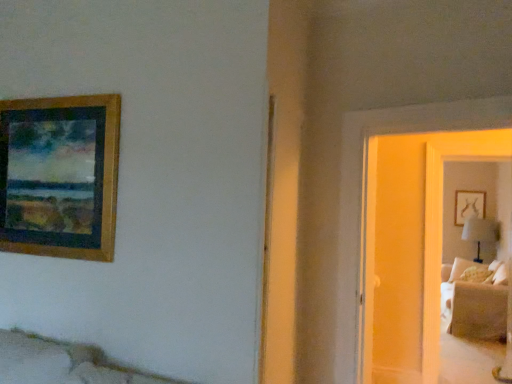
The width and height of the screenshot is (512, 384). What do you see at coordinates (480, 232) in the screenshot?
I see `white fabric table lamp at right` at bounding box center [480, 232].

Where is `wooden picture frame at upper left`? The width and height of the screenshot is (512, 384). wooden picture frame at upper left is located at coordinates (60, 176).

Describe the element at coordinates (411, 247) in the screenshot. I see `matte glass door at right` at that location.

What do you see at coordinates (475, 308) in the screenshot? I see `suede beige couch at right` at bounding box center [475, 308].

The image size is (512, 384). Find the location of `white fabric table lamp at right`. white fabric table lamp at right is located at coordinates (480, 232).

Are wooden picture frame at upper left and white fabric table lamp at right located far from each other?

wooden picture frame at upper left is positioned a significant distance from white fabric table lamp at right.

Which is correct: wooden picture frame at upper left is inside white fabric table lamp at right, or outside of it?

wooden picture frame at upper left exists outside the volume of white fabric table lamp at right.

Which is behind, point (44, 148) or point (476, 229)?

The point (476, 229) is farther from the camera.

From the image's perspective, is wooden picture frame at upper left located above or below white fabric table lamp at right?

wooden picture frame at upper left is above white fabric table lamp at right.

In the image, is white fabric table lamp at right positioned in front of or behind matte glass door at right?

white fabric table lamp at right is positioned farther from the viewer than matte glass door at right.

Does point (465, 220) appear closer or farther from the camera than point (406, 297)?

Point (465, 220) is positioned farther from the camera compared to point (406, 297).

In the scene shown: Based on their positions, is white fabric table lamp at right located to the left or right of matte glass door at right?

In the image, white fabric table lamp at right appears on the right side of matte glass door at right.

Does white fabric table lamp at right have a greater width compared to matte glass door at right?

Yes.

Is matte glass door at right facing away from wooden picture frame at upper left?

No.

Is point (375, 312) positioned behind point (35, 175)?

Yes, it is behind point (35, 175).

Is matte glass door at right inside or outside of wooden picture frame at upper left?

matte glass door at right is not enclosed by wooden picture frame at upper left.

Consider the image. Which object is thinner, wooden picture frame at upper left or suede beige couch at right?

Thinner between the two is wooden picture frame at upper left.

Is the surface of wooden picture frame at upper left in direct contact with suede beige couch at right?

wooden picture frame at upper left and suede beige couch at right are not in contact.

Looking at this image, considering the relative sizes of wooden picture frame at upper left and suede beige couch at right in the image provided, is wooden picture frame at upper left smaller than suede beige couch at right?

Yes, wooden picture frame at upper left is smaller than suede beige couch at right.

Does wooden picture frame at upper left have a lesser height compared to suede beige couch at right?

Yes.

Is point (369, 166) closer to camera compared to point (474, 294)?

Yes, it is in front of point (474, 294).

From their relative heights in the image, would you say matte glass door at right is taller or shorter than suede beige couch at right?

Clearly, matte glass door at right is taller compared to suede beige couch at right.

At what (x,y) coordinates should I click in order to perform the action: click on couch on the right of matte glass door at right. Please return your answer as a coordinate pair (x, y). Looking at the image, I should click on point(475,308).

Is matte glass door at right not within suede beige couch at right?

Yes, matte glass door at right is outside of suede beige couch at right.

Considering the positions of points (457, 322) and (412, 179), is point (457, 322) closer to camera compared to point (412, 179)?

No, (457, 322) is behind (412, 179).

Which object is further away from the camera taking this photo, suede beige couch at right or matte glass door at right?

Positioned behind is suede beige couch at right.

Find the location of a particular element. couch on the right of matte glass door at right is located at coordinates (475, 308).

Are suede beige couch at right and matte glass door at right beside each other?

suede beige couch at right and matte glass door at right are not in contact.

Is suede beige couch at right at the right side of white fabric table lamp at right?

No.

Is suede beige couch at right inside or outside of white fabric table lamp at right?

suede beige couch at right exists outside the volume of white fabric table lamp at right.

Looking at their sizes, would you say suede beige couch at right is wider or thinner than white fabric table lamp at right?

Clearly, suede beige couch at right has more width compared to white fabric table lamp at right.

You are a GUI agent. You are given a task and a screenshot of the screen. Output one action in this format:
    pyautogui.click(x=<x>, y=<y>)
    Task: Click on the table lamp that is behind the wooden picture frame at upper left
    This screenshot has width=512, height=384.
    Given the screenshot: What is the action you would take?
    pyautogui.click(x=480, y=232)

You are a GUI agent. You are given a task and a screenshot of the screen. Output one action in this format:
    pyautogui.click(x=<x>, y=<y>)
    Task: Click on the table lamp that appears below the matte glass door at right (from a real-world perspective)
    This screenshot has height=384, width=512.
    Given the screenshot: What is the action you would take?
    (480, 232)

Considering their positions, is suede beige couch at right positioned further to matte glass door at right than wooden picture frame at upper left?

The object further to matte glass door at right is wooden picture frame at upper left.

Looking at the image, which one is located closer to suede beige couch at right, matte glass door at right or wooden picture frame at upper left?

matte glass door at right is positioned closer to the anchor suede beige couch at right.

Estimate the real-world distances between objects in this image. Which object is further from suede beige couch at right, wooden picture frame at upper left or matte glass door at right?

wooden picture frame at upper left lies further to suede beige couch at right than the other object.

Consider the image. Based on their spatial positions, is suede beige couch at right or matte glass door at right further from white fabric table lamp at right?

matte glass door at right.

Estimate the real-world distances between objects in this image. Which object is further from matte glass door at right, wooden picture frame at upper left or suede beige couch at right?

wooden picture frame at upper left.

When comparing their distances from white fabric table lamp at right, does wooden picture frame at upper left or matte glass door at right seem closer?

matte glass door at right is closer to white fabric table lamp at right.

Considering their positions, is suede beige couch at right positioned further to white fabric table lamp at right than wooden picture frame at upper left?

Among the two, wooden picture frame at upper left is located further to white fabric table lamp at right.

Which object lies further to the anchor point white fabric table lamp at right, wooden picture frame at upper left or suede beige couch at right?

wooden picture frame at upper left lies further to white fabric table lamp at right than the other object.

The image size is (512, 384). Find the location of `glass door located between wooden picture frame at upper left and suede beige couch at right in the left-right direction`. glass door located between wooden picture frame at upper left and suede beige couch at right in the left-right direction is located at coordinates (411, 247).

The height and width of the screenshot is (384, 512). What are the coordinates of `couch located between wooden picture frame at upper left and white fabric table lamp at right in the left-right direction` in the screenshot? It's located at (475, 308).

Identify the location of couch between matte glass door at right and white fabric table lamp at right along the z-axis. This screenshot has width=512, height=384. (475, 308).

Where is `picture frame between matte glass door at right and white fabric table lamp at right in the front-back direction`? Image resolution: width=512 pixels, height=384 pixels. picture frame between matte glass door at right and white fabric table lamp at right in the front-back direction is located at coordinates (60, 176).